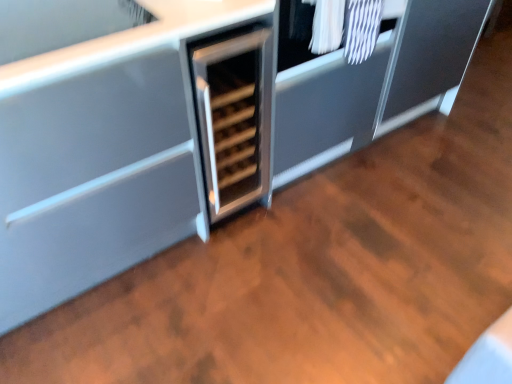
Describe the element at coordinates (346, 27) in the screenshot. This screenshot has width=512, height=384. I see `white textured laundry at upper right` at that location.

In order to click on white textured laundry at upper right in this screenshot , I will do `click(346, 27)`.

Describe the element at coordinates (322, 101) in the screenshot. I see `satin silver wine cooler at center` at that location.

Measure the distance between satin silver wine cooler at center and camera.

satin silver wine cooler at center is 4.70 feet from camera.

This screenshot has width=512, height=384. Find the location of `satin silver wine cooler at center`. satin silver wine cooler at center is located at coordinates (322, 101).

Measure the distance between point (275, 162) and camera.

A distance of 1.82 meters exists between point (275, 162) and camera.

Locate an element on the screen. The width and height of the screenshot is (512, 384). white textured laundry at upper right is located at coordinates (346, 27).

Can you confirm if white textured laundry at upper right is positioned to the left of satin silver wine cooler at center?

No.

Between white textured laundry at upper right and satin silver wine cooler at center, which one is positioned behind?

Positioned behind is satin silver wine cooler at center.

Is point (316, 30) closer or farther from the camera than point (379, 67)?

Clearly, point (316, 30) is closer to the camera than point (379, 67).

From the image's perspective, is white textured laundry at upper right positioned above or below satin silver wine cooler at center?

From the image's perspective, white textured laundry at upper right appears above satin silver wine cooler at center.

Consider the image. From a real-world perspective, is white textured laundry at upper right under satin silver wine cooler at center?

Actually, white textured laundry at upper right is physically above satin silver wine cooler at center in the real world.

From the picture: Which object is thinner, white textured laundry at upper right or satin silver wine cooler at center?

With smaller width is white textured laundry at upper right.

Which of these two, white textured laundry at upper right or satin silver wine cooler at center, stands taller?

satin silver wine cooler at center is taller.

Based on their sizes in the image, would you say white textured laundry at upper right is bigger or smaller than satin silver wine cooler at center?

Clearly, white textured laundry at upper right is smaller in size than satin silver wine cooler at center.

Consider the image. Is white textured laundry at upper right not inside satin silver wine cooler at center?

Absolutely, white textured laundry at upper right is external to satin silver wine cooler at center.

Are white textured laundry at upper right and satin silver wine cooler at center located far from each other?

No.

Is white textured laundry at upper right facing away from satin silver wine cooler at center?

Yes, white textured laundry at upper right's orientation is away from satin silver wine cooler at center.

Measure the distance between white textured laundry at upper right and satin silver wine cooler at center.

white textured laundry at upper right is 8.69 inches away from satin silver wine cooler at center.

Find the location of a particular element. The width and height of the screenshot is (512, 384). laundry that is on the right side of satin silver wine cooler at center is located at coordinates (346, 27).

Which is more to the right, satin silver wine cooler at center or white textured laundry at upper right?

Positioned to the right is white textured laundry at upper right.

Consider the image. Is satin silver wine cooler at center positioned before white textured laundry at upper right?

No, the depth of satin silver wine cooler at center is greater than that of white textured laundry at upper right.

Is point (354, 72) positioned before point (350, 63)?

No, (354, 72) is further to viewer.

From the image's perspective, is satin silver wine cooler at center positioned above or below white textured laundry at upper right?

satin silver wine cooler at center is below white textured laundry at upper right.

From a real-world perspective, between satin silver wine cooler at center and white textured laundry at upper right, who is vertically lower?

satin silver wine cooler at center, from a real-world perspective.

Can you confirm if satin silver wine cooler at center is wider than white textured laundry at upper right?

Correct, the width of satin silver wine cooler at center exceeds that of white textured laundry at upper right.

Can you confirm if satin silver wine cooler at center is taller than white textured laundry at upper right?

Correct, satin silver wine cooler at center is much taller as white textured laundry at upper right.

Considering the relative sizes of satin silver wine cooler at center and white textured laundry at upper right in the image provided, is satin silver wine cooler at center bigger than white textured laundry at upper right?

Correct, satin silver wine cooler at center is larger in size than white textured laundry at upper right.

Is satin silver wine cooler at center located outside white textured laundry at upper right?

Yes, satin silver wine cooler at center is located beyond the bounds of white textured laundry at upper right.

Consider the image. Does satin silver wine cooler at center touch white textured laundry at upper right?

No.

Is satin silver wine cooler at center positioned with its back to white textured laundry at upper right?

satin silver wine cooler at center does not have its back to white textured laundry at upper right.

How different are the orientations of satin silver wine cooler at center and white textured laundry at upper right in degrees?

The angle between the facing direction of satin silver wine cooler at center and the facing direction of white textured laundry at upper right is 0.00109 degrees.

How far apart are satin silver wine cooler at center and white textured laundry at upper right?

satin silver wine cooler at center and white textured laundry at upper right are 8.69 inches apart.

Find the location of a particular element. The height and width of the screenshot is (384, 512). laundry that appears above the satin silver wine cooler at center (from the image's perspective) is located at coordinates (346, 27).

Where is `laundry in front of the satin silver wine cooler at center`? laundry in front of the satin silver wine cooler at center is located at coordinates (346, 27).

This screenshot has width=512, height=384. Find the location of `cabinetry lying below the white textured laundry at upper right (from the image's perspective)`. cabinetry lying below the white textured laundry at upper right (from the image's perspective) is located at coordinates (322, 101).